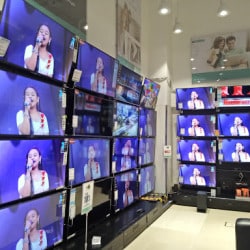
At what (x,y) coordinates should I click in order to perform the action: click on platform holding tv. Please return your answer as a coordinate pair (x, y). This screenshot has height=250, width=250. Looking at the image, I should click on (112, 224), (232, 198).